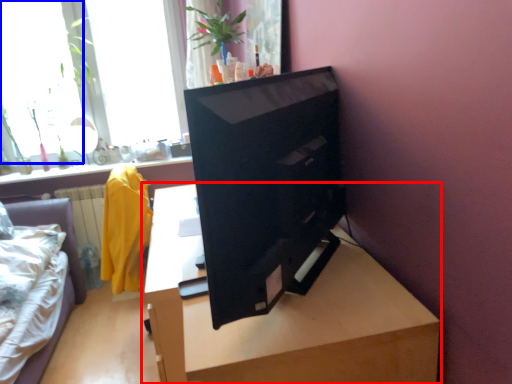
Question: Among these objects, which one is farthest to the camera, table (highlighted by a red box) or window (highlighted by a blue box)?

Choices:
 (A) table
 (B) window

Answer: (B)